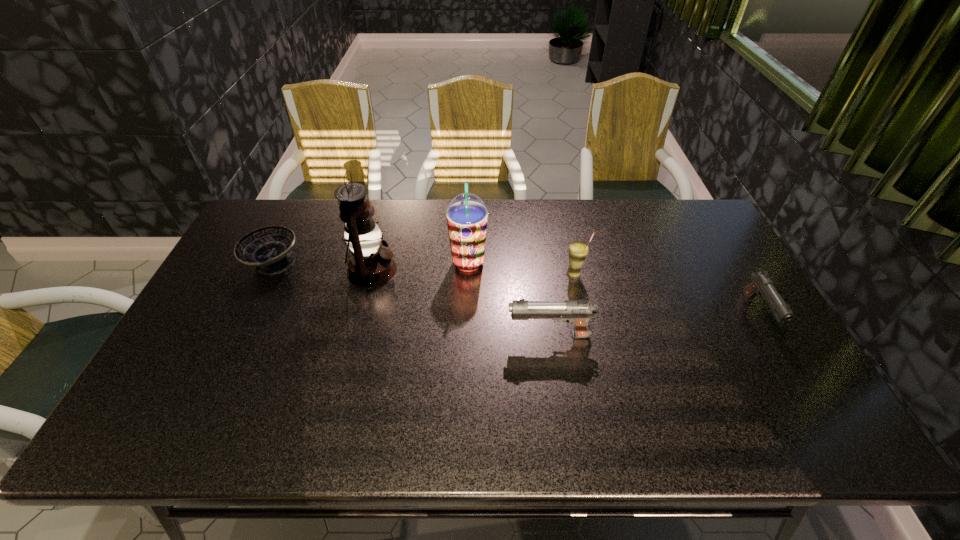
The height and width of the screenshot is (540, 960). I want to click on the taller gun, so click(x=576, y=312).

This screenshot has height=540, width=960. Find the location of `the left gun`. the left gun is located at coordinates (576, 312).

Locate an element on the screen. the shorter gun is located at coordinates (762, 285).

You are a GUI agent. You are given a task and a screenshot of the screen. Output one action in this format:
    pyautogui.click(x=<x>, y=<y>)
    Task: Click on the rightmost object
    
    Given the screenshot: What is the action you would take?
    pyautogui.click(x=762, y=285)

Identify the location of the third tallest object. (578, 251).

This screenshot has height=540, width=960. I want to click on the tallest object, so click(x=369, y=265).

Where is `lantern`? The width and height of the screenshot is (960, 540). lantern is located at coordinates (369, 265).

The width and height of the screenshot is (960, 540). Find the location of `the leftmost object`. the leftmost object is located at coordinates (269, 248).

Where is `bowl`? The height and width of the screenshot is (540, 960). bowl is located at coordinates [x=269, y=248].

What are the coordinates of `the fifth shortest object` in the screenshot? It's located at (467, 215).